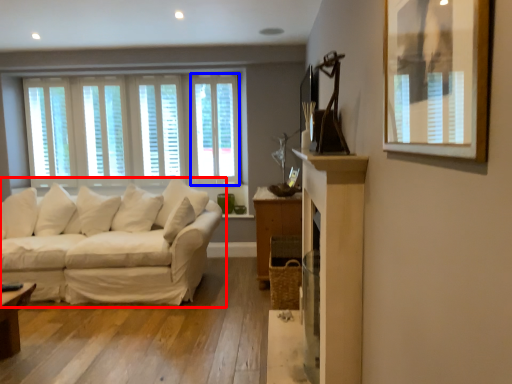
Question: Which object appears farthest to the camera in this image, studio couch (highlighted by a red box) or window (highlighted by a blue box)?

Choices:
 (A) studio couch
 (B) window

Answer: (B)